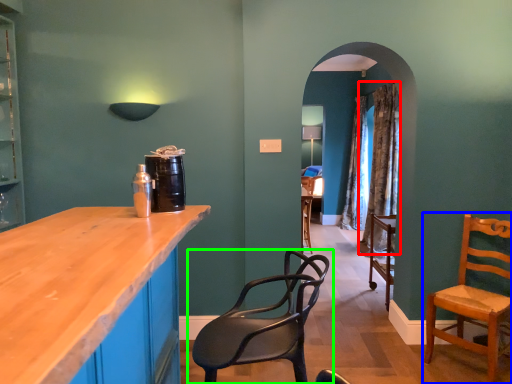
Question: Which object is the closest to the curtain (highlighted by a red box)? Choose among these: chair (highlighted by a blue box) or chair (highlighted by a green box).

Choices:
 (A) chair
 (B) chair

Answer: (A)